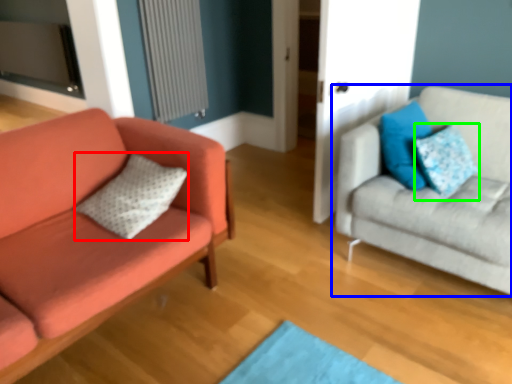
Question: Estimate the real-world distances between objects in this image. Which object is farther from pillow (highlighted by a red box), studio couch (highlighted by a blue box) or pillow (highlighted by a green box)?

Choices:
 (A) studio couch
 (B) pillow

Answer: (B)